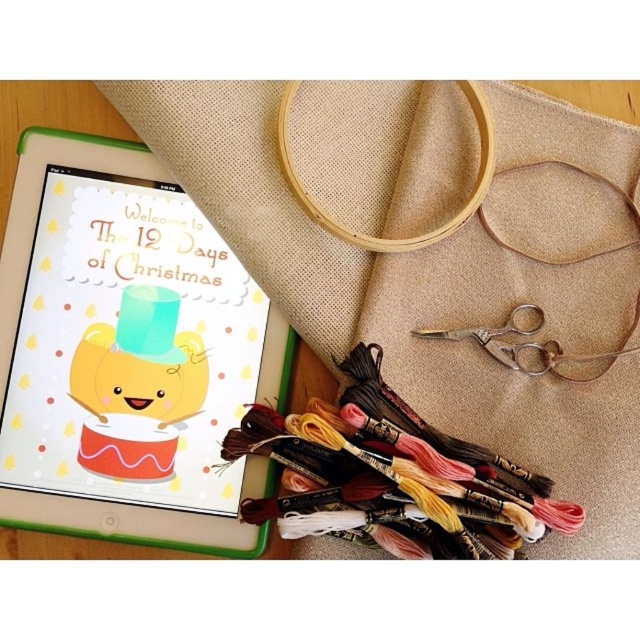
From the picture: You are setting up a craft station and need to place the beige fabric at upper center and the antique brass scissors at center. According to the image, which object is positioned to the right of the other?

The antique brass scissors at center are to the right of the beige fabric at upper center.